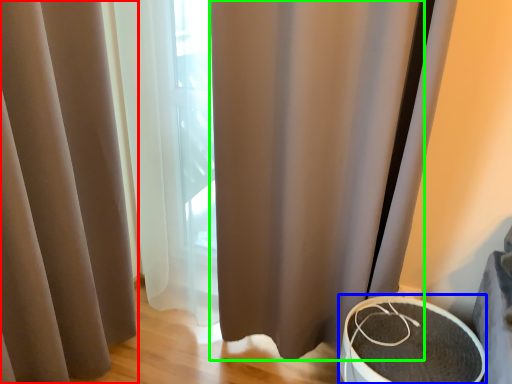
Question: Which is nearer to the curtain (highlighted by a red box)? round table (highlighted by a blue box) or shower curtain (highlighted by a green box).

Choices:
 (A) round table
 (B) shower curtain

Answer: (B)